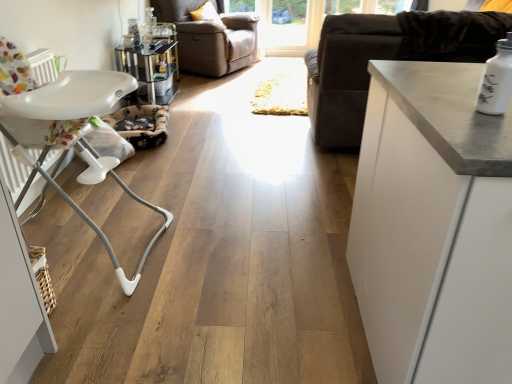
Question: Considering the relative sizes of white plastic highchair at left and transparent glass window at upper center, which is the second window screen from left to right, in the image provided, is white plastic highchair at left wider than transparent glass window at upper center, which is the second window screen from left to right,?

Choices:
 (A) yes
 (B) no

Answer: (A)

Question: Is the surface of white plastic highchair at left in direct contact with transparent glass window at upper center, which is the second window screen from left to right?

Choices:
 (A) no
 (B) yes

Answer: (A)

Question: Is white plastic highchair at left not within transparent glass window at upper center, which is the second window screen from left to right?

Choices:
 (A) yes
 (B) no

Answer: (A)

Question: From a real-world perspective, does white plastic highchair at left sit lower than transparent glass window at upper center, marked as the 1th window screen in a right-to-left arrangement?

Choices:
 (A) yes
 (B) no

Answer: (B)

Question: Is transparent glass window at upper center, which is the second window screen from left to right, surrounded by white plastic highchair at left?

Choices:
 (A) no
 (B) yes

Answer: (A)

Question: Is the position of white plastic highchair at left less distant than that of transparent glass window at upper center, marked as the 1th window screen in a right-to-left arrangement?

Choices:
 (A) no
 (B) yes

Answer: (B)

Question: Is white matte cabinet at upper right surrounded by beige leather armchair at upper center?

Choices:
 (A) no
 (B) yes

Answer: (A)

Question: From the image's perspective, is beige leather armchair at upper center above white matte cabinet at upper right?

Choices:
 (A) no
 (B) yes

Answer: (B)

Question: Does beige leather armchair at upper center turn towards white matte cabinet at upper right?

Choices:
 (A) yes
 (B) no

Answer: (B)

Question: Can you confirm if beige leather armchair at upper center is wider than white matte cabinet at upper right?

Choices:
 (A) no
 (B) yes

Answer: (A)

Question: Can you confirm if beige leather armchair at upper center is taller than white matte cabinet at upper right?

Choices:
 (A) yes
 (B) no

Answer: (B)

Question: Is beige leather armchair at upper center to the right of white matte cabinet at upper right from the viewer's perspective?

Choices:
 (A) yes
 (B) no

Answer: (B)

Question: Is transparent glass door at upper center, the second window screen from the right, placed right next to transparent glass window at upper center, marked as the 1th window screen in a right-to-left arrangement?

Choices:
 (A) yes
 (B) no

Answer: (B)